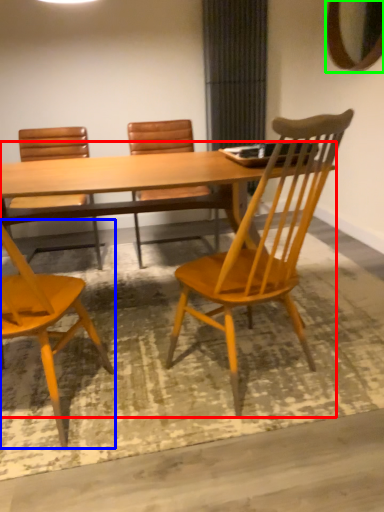
Question: Estimate the real-world distances between objects in this image. Which object is closer to kitchen & dining room table (highlighted by a red box), chair (highlighted by a blue box) or mirror (highlighted by a green box)?

Choices:
 (A) chair
 (B) mirror

Answer: (A)